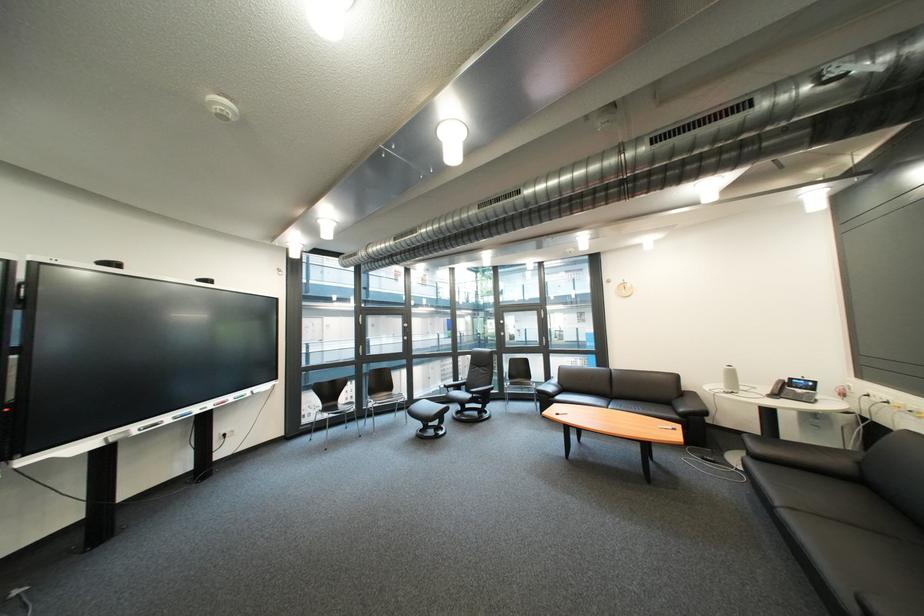
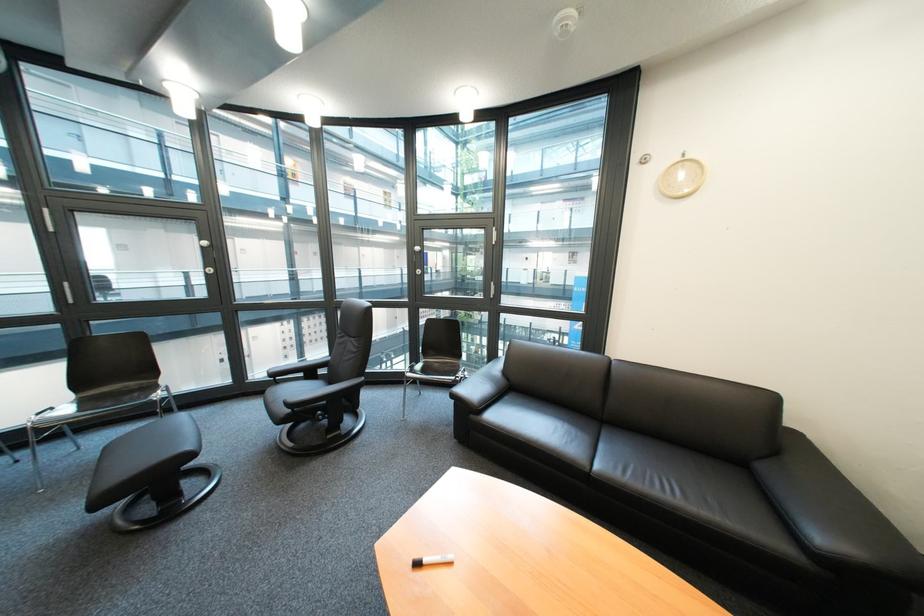
Where in the second image is the point corresponding to (x=695, y=411) from the first image?

(833, 540)